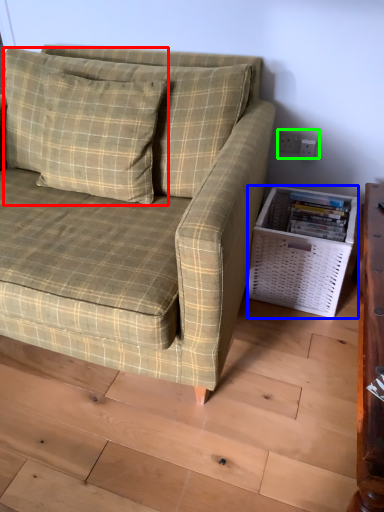
Question: Estimate the real-world distances between objects in this image. Which object is closer to pillow (highlighted by a red box), basket (highlighted by a blue box) or electric outlet (highlighted by a green box)?

Choices:
 (A) basket
 (B) electric outlet

Answer: (A)